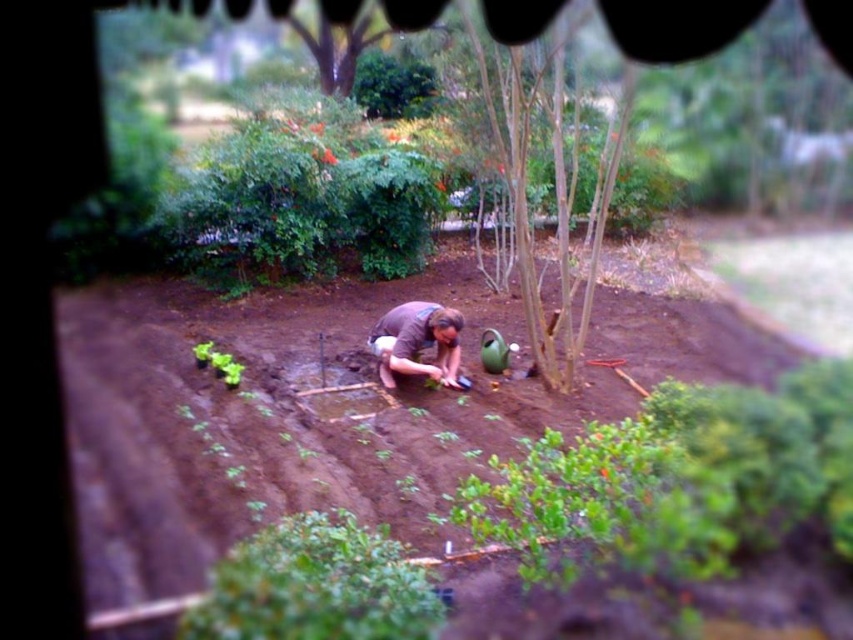
You are a gardener trying to reach the brown bark tree at center to water it. You are currently standing behind the brown cotton shirt at center. Which direction should you move to get closer to the tree?

Since the brown bark tree at center is further to the viewer than the brown cotton shirt at center, you should move forward to get closer to the brown bark tree at center.

You are standing in the garden and want to water the brown bark tree at center. The garden hose is 8 meters long. Is the hose long enough to reach the tree without moving the hose reel?

The brown bark tree at center is 8.60 meters away from the viewer. Since the hose is only 8 meters long, it is not long enough to reach the tree without moving the hose reel.